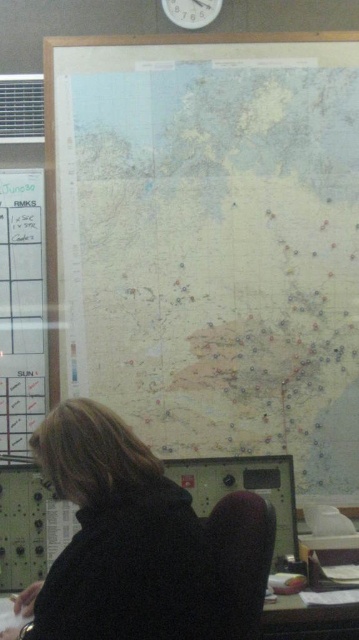
Question: Which of these objects is positioned closest to the dark brown hair at lower left?

Choices:
 (A) white paper at left
 (B) white plastic clock at upper center

Answer: (A)

Question: Does white paper at left appear under wooden desk at lower center?

Choices:
 (A) no
 (B) yes

Answer: (A)

Question: Which object is the closest to the white paper at left?

Choices:
 (A) wooden desk at lower center
 (B) light beige paper map at center
 (C) white plastic clock at upper center
 (D) dark brown hair at lower left

Answer: (B)

Question: Does dark brown hair at lower left have a greater width compared to wooden desk at lower center?

Choices:
 (A) yes
 (B) no

Answer: (A)

Question: Estimate the real-world distances between objects in this image. Which object is farther from the wooden desk at lower center?

Choices:
 (A) white paper at left
 (B) dark brown hair at lower left
 (C) white plastic clock at upper center
 (D) light beige paper map at center

Answer: (C)

Question: Can you confirm if white paper at left is wider than wooden desk at lower center?

Choices:
 (A) yes
 (B) no

Answer: (B)